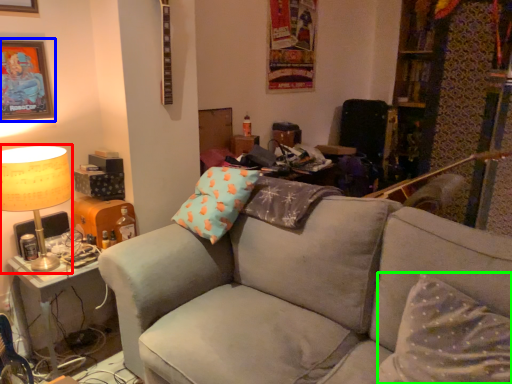
Question: Which is farther away from table lamp (highlighted by a red box)? picture frame (highlighted by a blue box) or pillow (highlighted by a green box)?

Choices:
 (A) picture frame
 (B) pillow

Answer: (B)